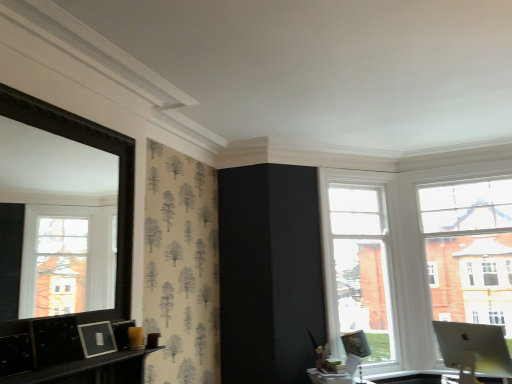
Question: Is clear glass window at center, which is counted as the first window, starting from the left, spatially inside metallic silver swivel chair at right, or outside of it?

Choices:
 (A) outside
 (B) inside

Answer: (A)

Question: Is clear glass window at center, which is counted as the first window, starting from the left, in front of or behind metallic silver swivel chair at right in the image?

Choices:
 (A) front
 (B) behind

Answer: (B)

Question: Considering the real-world distances, which object is closest to the clear glass window at center, the second window viewed from the right?

Choices:
 (A) white glass window at upper right, which ranks as the 1th window in right-to-left order
 (B) metallic silver swivel chair at right
 (C) silver metallic monitor at lower right

Answer: (B)

Question: Which object is positioned farthest from the white glass window at upper right, the 2th window in the left-to-right sequence?

Choices:
 (A) silver metallic monitor at lower right
 (B) clear glass window at center, which is counted as the first window, starting from the left
 (C) metallic silver swivel chair at right

Answer: (A)